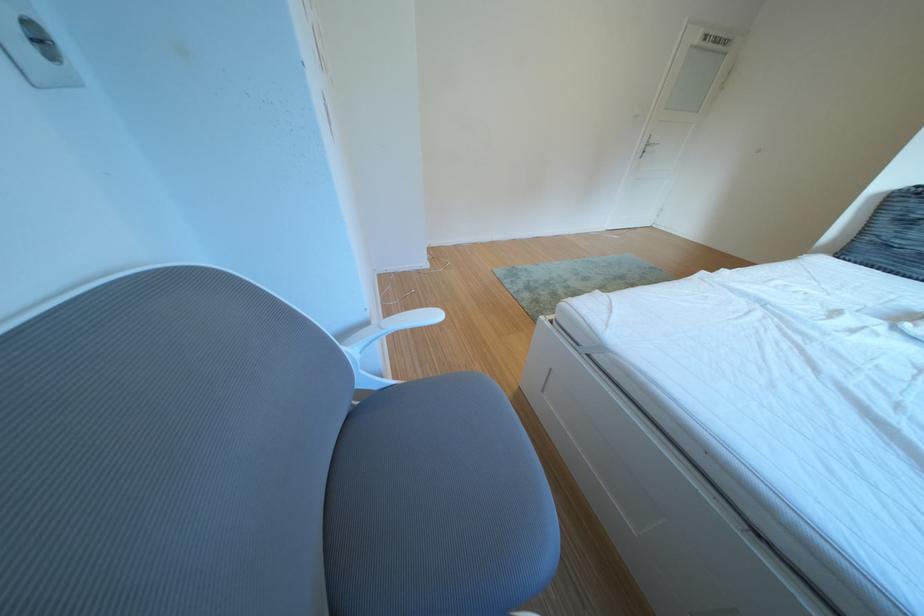
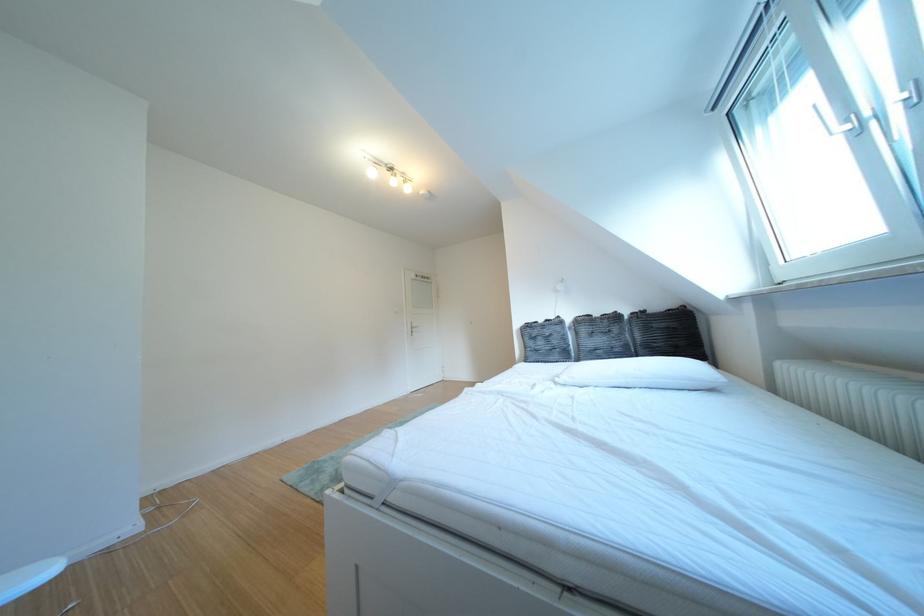
How did the camera likely rotate?

The rotation direction of the camera is right-up.